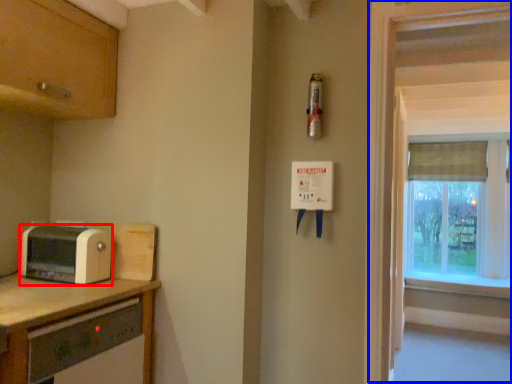
Question: Which of the following is the farthest to the observer, toaster (highlighted by a red box) or window frame (highlighted by a blue box)?

Choices:
 (A) toaster
 (B) window frame

Answer: (A)